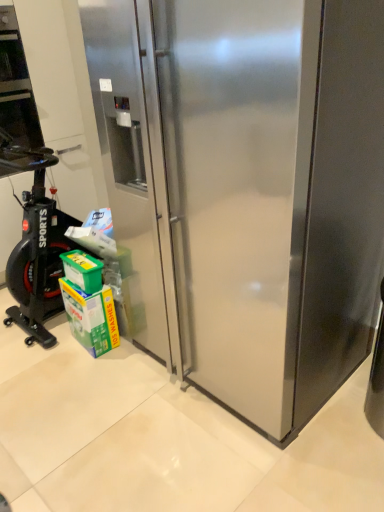
This screenshot has width=384, height=512. Identify the location of free space above green plastic box at lower left (from a real-world perspective). (77, 258).